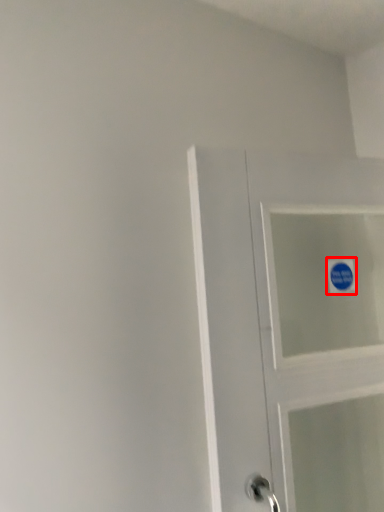
Question: From the image, what is the correct spatial relationship of sticker (annotated by the red box) in relation to door?

Choices:
 (A) right
 (B) left

Answer: (A)